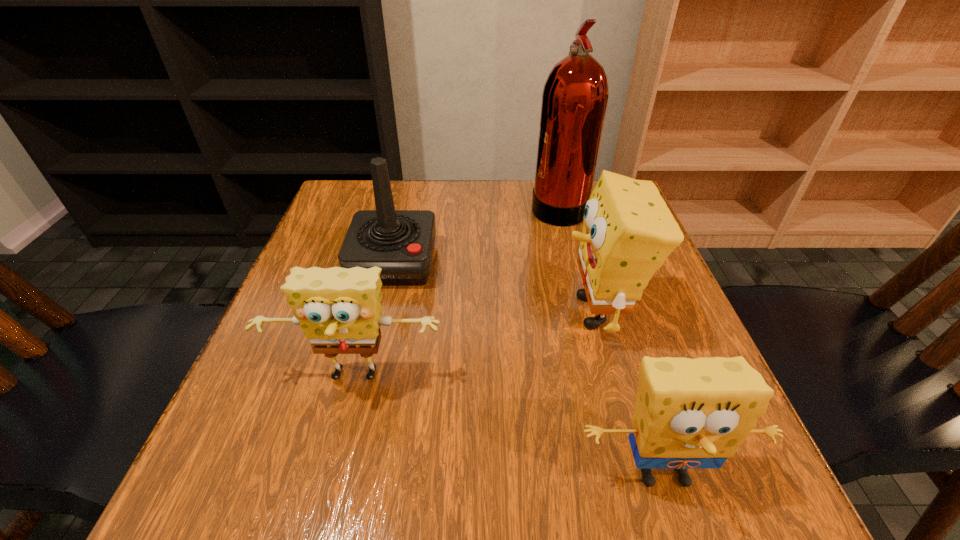
I want to click on object located at the far right corner, so click(x=575, y=95).

Where is `object located at the near right corner`? The width and height of the screenshot is (960, 540). object located at the near right corner is located at coordinates (689, 413).

In the image, there is a desktop. Where is `vacant space at the far edge`? vacant space at the far edge is located at coordinates (401, 206).

In the image, there is a desktop. Identify the location of vacant space at the near edge. This screenshot has height=540, width=960. (556, 491).

Image resolution: width=960 pixels, height=540 pixels. Find the location of `vacant region at the left edge of the desktop`. vacant region at the left edge of the desktop is located at coordinates (272, 341).

In the image, there is a desktop. Where is `free space at the right edge`? free space at the right edge is located at coordinates (633, 408).

Where is `vacant space at the far left corner of the desktop`? This screenshot has height=540, width=960. vacant space at the far left corner of the desktop is located at coordinates (342, 184).

Identify the location of vacant point at the near left corner. (257, 467).

Find the location of a particular element. free spot between the farthest object and the second nearest sponge is located at coordinates (457, 292).

Locate an element on the screen. The image size is (960, 540). free spot between the nearest sponge and the farthest object is located at coordinates (611, 339).